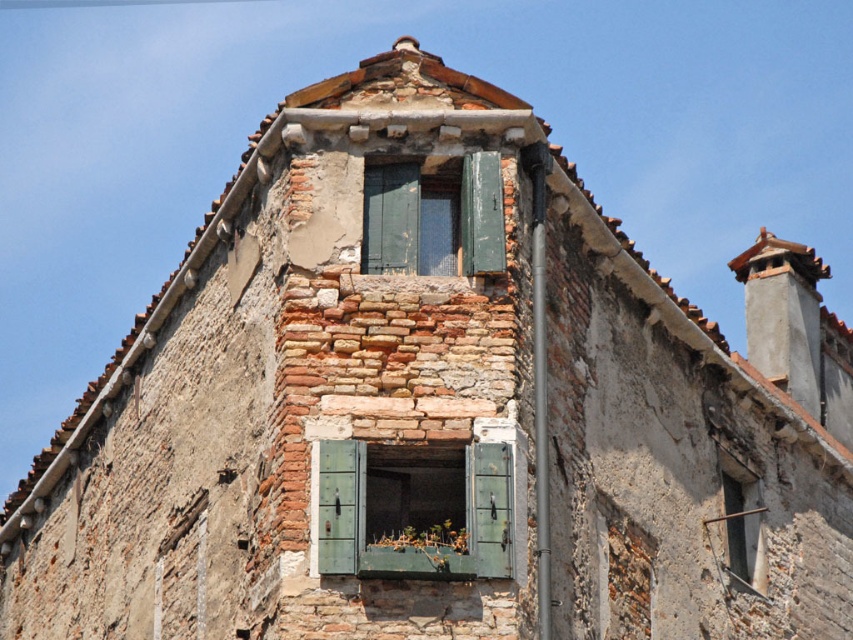
You are an architect inspecting the building and need to install a new decorative panel. The panel you have is wider than the green wooden window at upper center. Can you place it on the green painted wood at center without needing to cut it down?

The green painted wood at center has a larger width than the green wooden window at upper center. Since your panel is wider than the window, it might still fit on the green painted wood at center if the panel is not wider than the wood itself. However, without knowing the exact dimensions of the panel, it is uncertain. Please measure the panel against the green painted wood at center to confirm.

Consider the image. You are an architect analyzing the structural integrity of the building. You notice a green painted wood at center. Where exactly is this located in the image coordinates?

The green painted wood at center is located at point (410,516) in the image coordinates.

You are an architect inspecting the building. You notice the green painted wood at center and the green wooden window at upper center. Which one has a larger surface area?

The green painted wood at center has a larger surface area than the green wooden window at upper center.